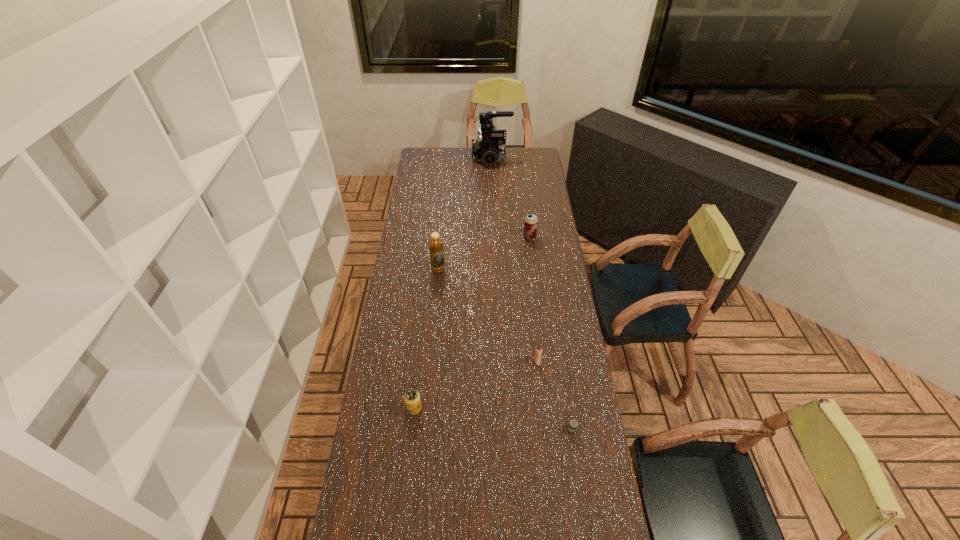
I want to click on igniter positioned at the right edge, so click(538, 351).

Locate an element on the screen. The height and width of the screenshot is (540, 960). vacant area at the far edge is located at coordinates (455, 159).

The width and height of the screenshot is (960, 540). In the image, there is a desktop. Identify the location of free space at the left edge. (384, 341).

This screenshot has width=960, height=540. Identify the location of free region at the right edge of the desktop. (x=543, y=288).

Where is `vacant point at the far right corner`? The image size is (960, 540). vacant point at the far right corner is located at coordinates (532, 164).

Where is `free space between the farthest object and the shortest beer can`? The width and height of the screenshot is (960, 540). free space between the farthest object and the shortest beer can is located at coordinates (532, 294).

You are a GUI agent. You are given a task and a screenshot of the screen. Output one action in this format:
    pyautogui.click(x=<x>, y=<y>)
    Task: Click on the empty space between the shortest object and the tallest beer can
    
    Given the screenshot: What is the action you would take?
    pyautogui.click(x=551, y=333)

Identify the location of free space that is in between the shortest object and the tallest object. (532, 294).

Locate an element on the screen. Image resolution: width=960 pixels, height=540 pixels. free space that is in between the shortest beer can and the second shortest beer can is located at coordinates (493, 419).

Find the location of `free space between the fifth shortest object and the camcorder`. free space between the fifth shortest object and the camcorder is located at coordinates (465, 213).